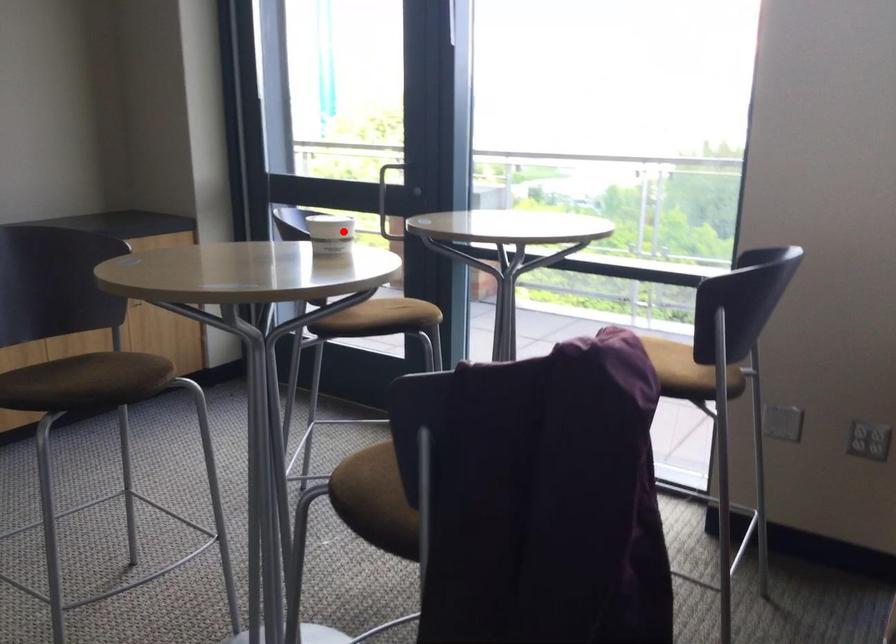
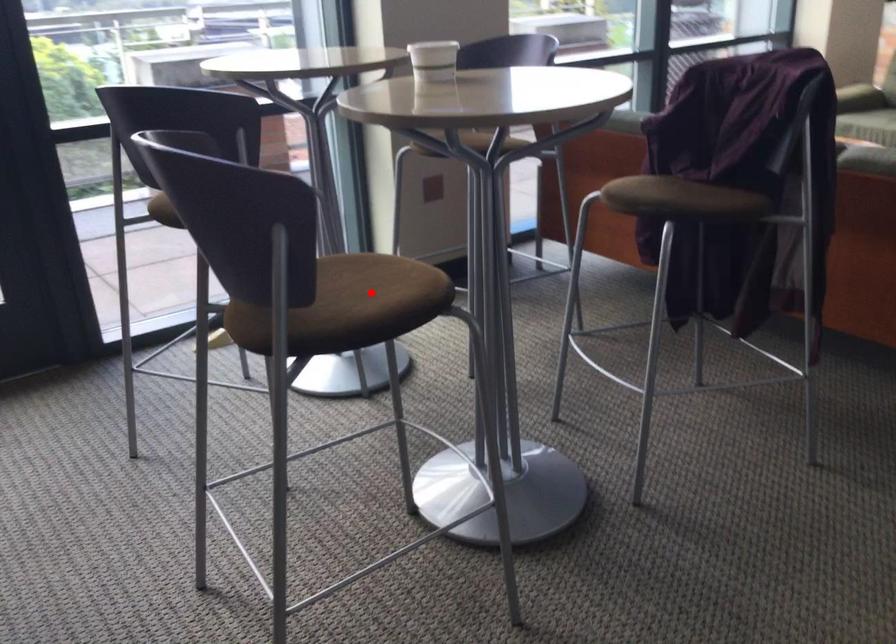
I am providing you with two images of the same scene from different viewpoints. A red point is marked on the first image and another point is marked on the second image. Is the red point in image1 aligned with the point shown in image2?

No